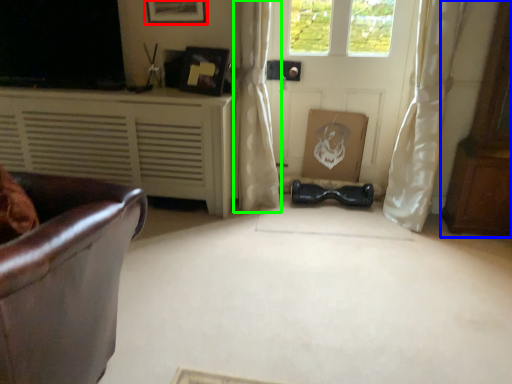
Question: Estimate the real-world distances between objects in this image. Which object is farther from picture frame (highlighted by a red box), dresser (highlighted by a blue box) or curtain (highlighted by a green box)?

Choices:
 (A) dresser
 (B) curtain

Answer: (A)